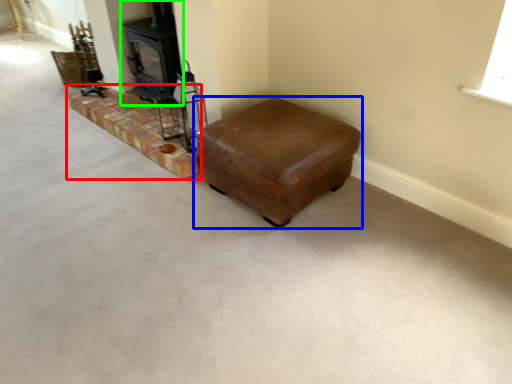
Question: Based on their relative distances, which object is nearer to stairwell (highlighted by a red box)? Choose from furniture (highlighted by a blue box) and wood burning stove (highlighted by a green box).

Choices:
 (A) furniture
 (B) wood burning stove

Answer: (B)